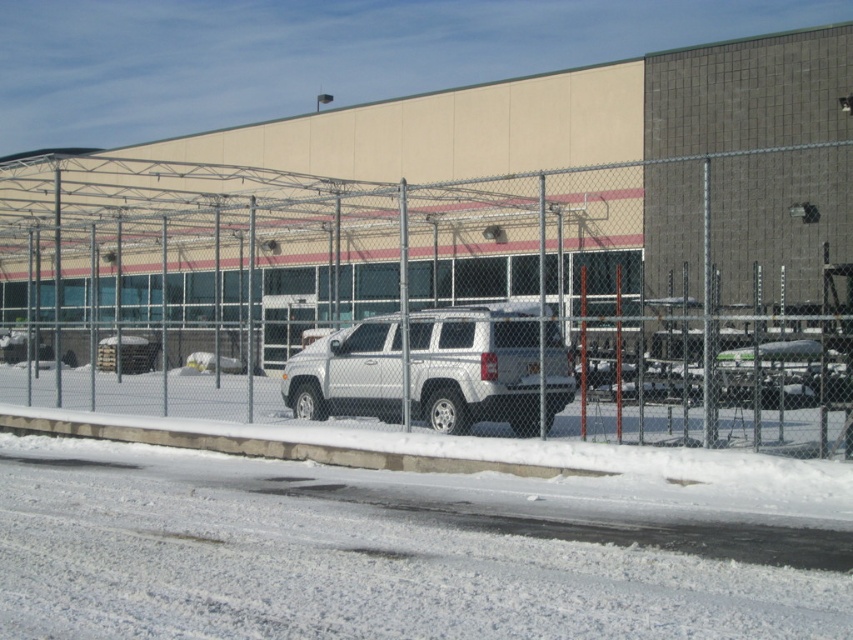
Who is taller, metal chain-link fence at center or silver metallic suv at center?

Standing taller between the two is metal chain-link fence at center.

Is point (625, 432) positioned in front of point (456, 396)?

Yes, point (625, 432) is closer to viewer.

Where is `metal chain-link fence at center`? metal chain-link fence at center is located at coordinates coord(426,307).